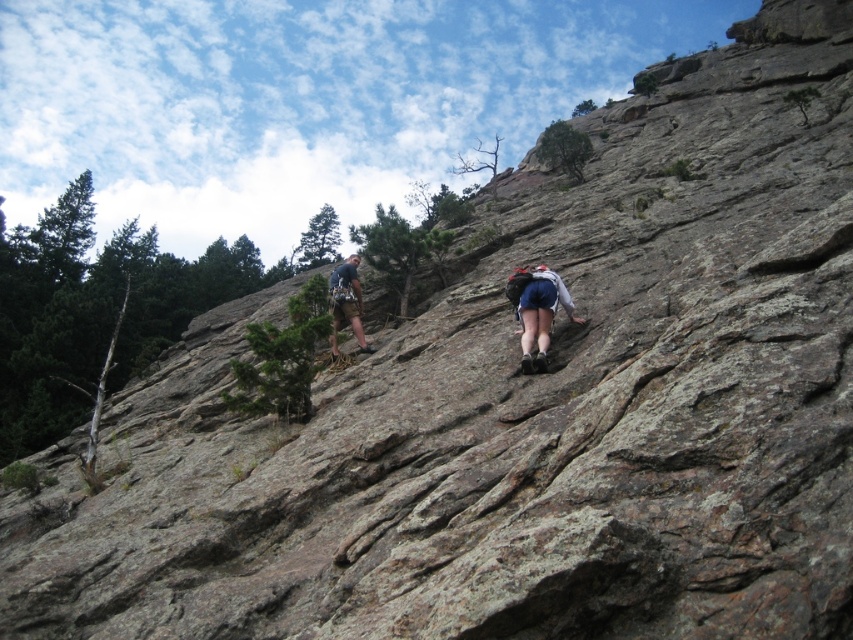
Who is more forward, (554, 282) or (335, 314)?

Point (554, 282)

In order to click on blue denim shorts at center in this screenshot , I will do `click(537, 310)`.